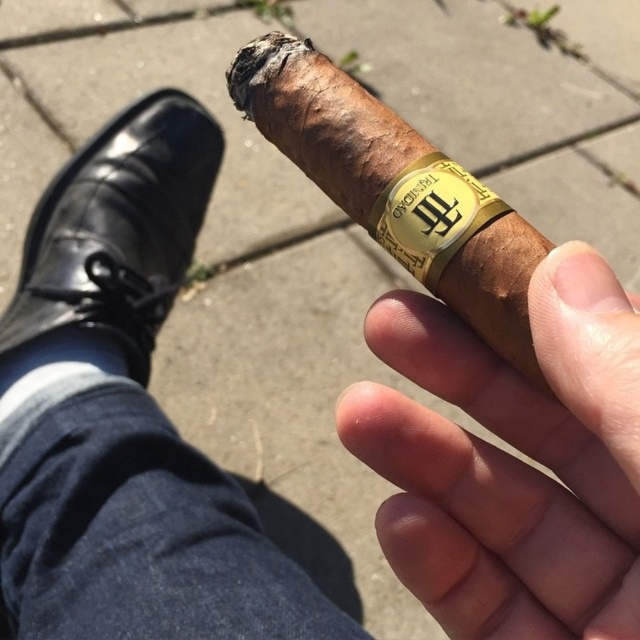
Question: Which point is closer to the camera?

Choices:
 (A) (145, 131)
 (B) (474, 404)

Answer: (B)

Question: Does smooth skin at center have a smaller size compared to black leather shoe at lower left?

Choices:
 (A) yes
 (B) no

Answer: (A)

Question: Which point is farther to the camera?

Choices:
 (A) black leather shoe at lower left
 (B) smooth skin at center

Answer: (A)

Question: Which object is closer to the camera taking this photo?

Choices:
 (A) black leather shoe at lower left
 (B) smooth skin at center

Answer: (B)

Question: Does smooth skin at center have a greater width compared to black leather shoe at lower left?

Choices:
 (A) yes
 (B) no

Answer: (B)

Question: Is smooth skin at center behind black leather shoe at lower left?

Choices:
 (A) no
 (B) yes

Answer: (A)